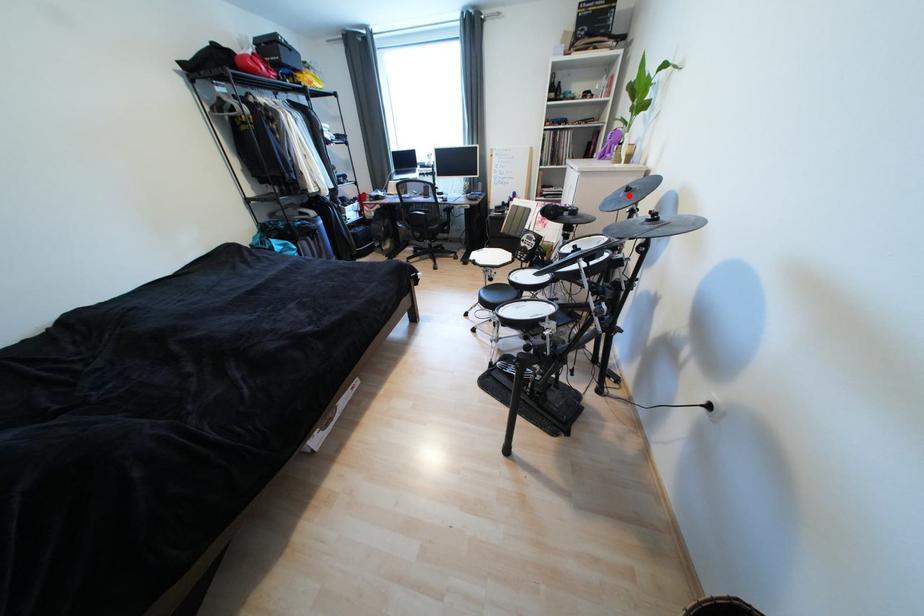
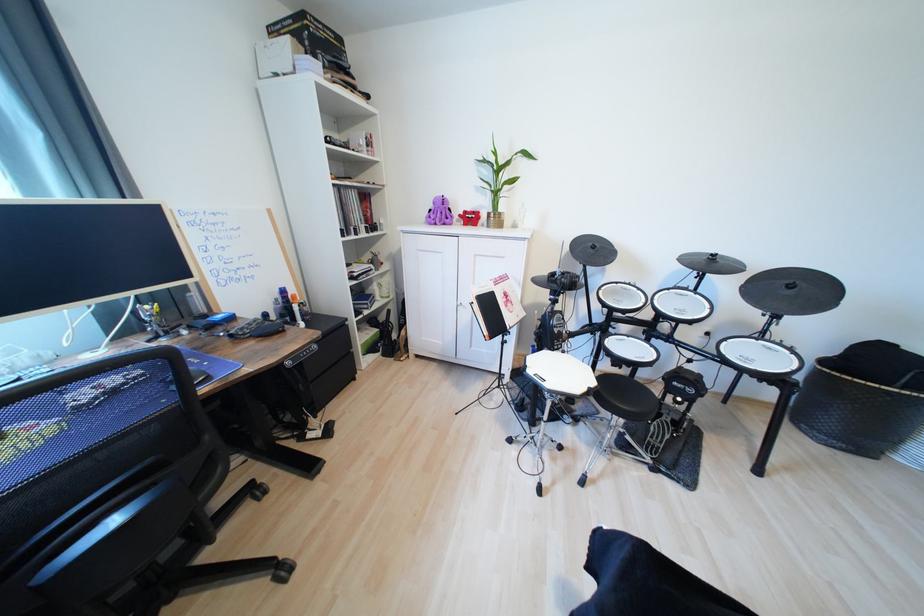
Question: I am providing you with two images of the same scene from different viewpoints. A red point is marked on the first image. Is the red point's position out of view in image 2?

Choices:
 (A) Yes
 (B) No

Answer: (B)